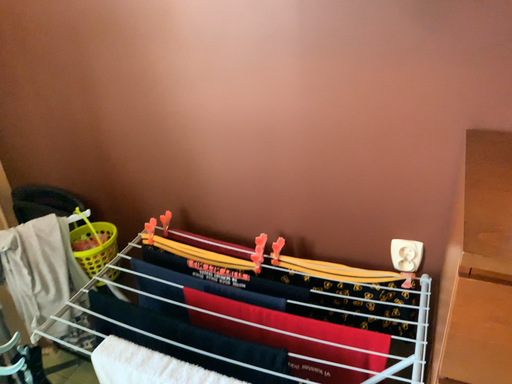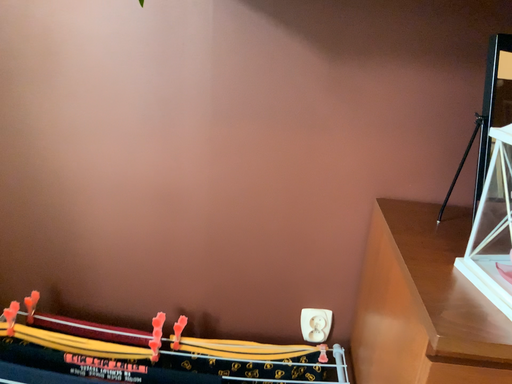
Question: How did the camera likely rotate when shooting the video?

Choices:
 (A) rotated right
 (B) rotated left

Answer: (A)